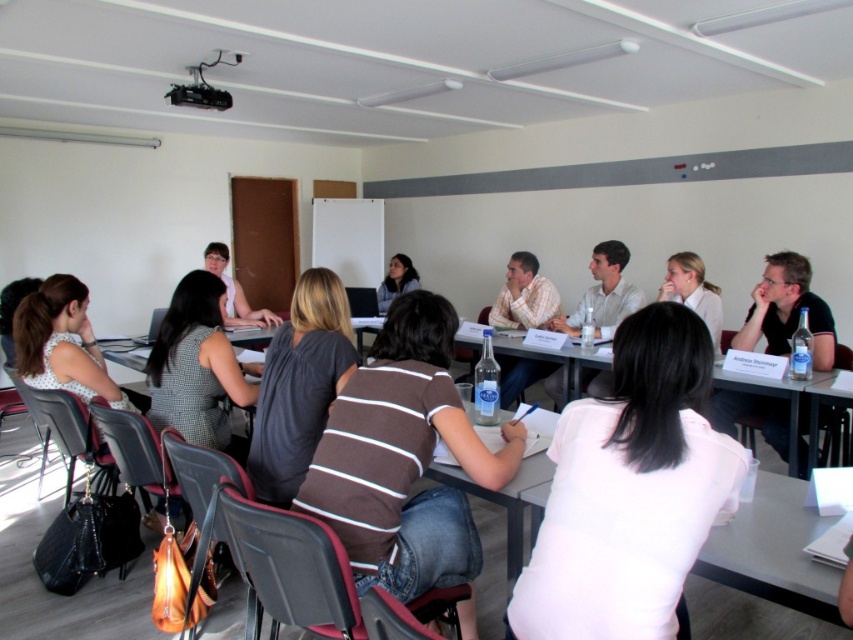
Does brown striped shirt at center appear on the left side of light beige shirt at center?

Yes, brown striped shirt at center is to the left of light beige shirt at center.

Is brown striped shirt at center in front of light beige shirt at center?

Yes, it is.

Describe the element at coordinates (404, 458) in the screenshot. This screenshot has height=640, width=853. I see `brown striped shirt at center` at that location.

This screenshot has height=640, width=853. What are the coordinates of `brown striped shirt at center` in the screenshot? It's located at (404, 458).

Who is taller, black matte shirt at right or matte black shirt at center?

black matte shirt at right

Does black matte shirt at right appear on the right side of matte black shirt at center?

Correct, you'll find black matte shirt at right to the right of matte black shirt at center.

The image size is (853, 640). In order to click on black matte shirt at right in this screenshot , I will do `click(787, 310)`.

Who is lower down, plaid cotton shirt at center or matte black shirt at center?

Positioned lower is plaid cotton shirt at center.

Between plaid cotton shirt at center and matte black shirt at center, which one has less height?

With less height is matte black shirt at center.

In order to click on plaid cotton shirt at center in this screenshot , I will do `click(524, 296)`.